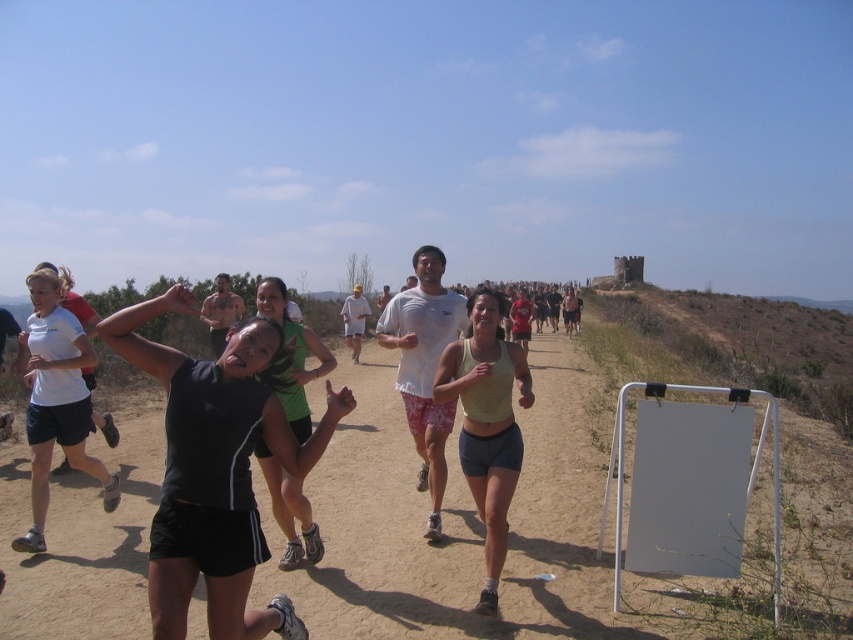
Between point (230, 416) and point (80, 401), which one is positioned in front?

Point (230, 416) is in front.

Between point (276, 596) and point (44, 385), which one is positioned in front?

Positioned in front is point (276, 596).

Find the location of a particular element. The width and height of the screenshot is (853, 640). black fabric tank top at center is located at coordinates (216, 470).

Can you confirm if light green tank top at center is wider than black athletic shorts at center?

Yes, light green tank top at center is wider than black athletic shorts at center.

Can you confirm if light green tank top at center is taller than black athletic shorts at center?

Yes, light green tank top at center is taller than black athletic shorts at center.

Measure the distance between point (485,371) and camera.

Point (485,371) and camera are 4.87 meters apart from each other.

The height and width of the screenshot is (640, 853). I want to click on light green tank top at center, so click(x=486, y=422).

Who is taller, black fabric tank top at center or light green tank top at center?

light green tank top at center is taller.

Who is higher up, black fabric tank top at center or light green tank top at center?

Positioned higher is black fabric tank top at center.

Is point (152, 596) positioned before point (508, 388)?

Yes, it is in front of point (508, 388).

At what (x,y) coordinates should I click in order to perform the action: click on black fabric tank top at center. Please return your answer as a coordinate pair (x, y). Image resolution: width=853 pixels, height=640 pixels. Looking at the image, I should click on (216, 470).